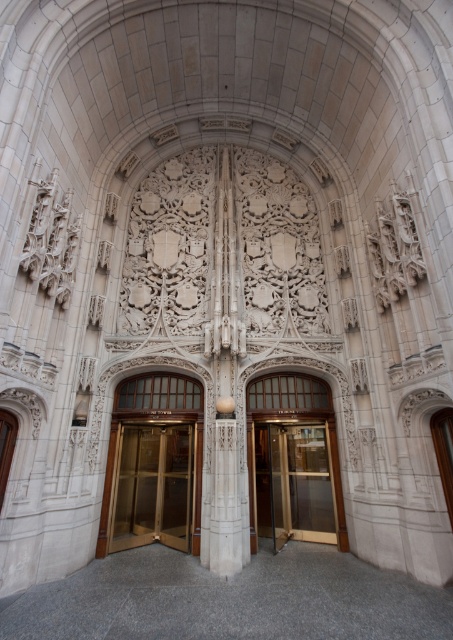
Can you confirm if gold/glass elevator at center is smaller than gold/glass elevator doors at center?

Yes.

Who is positioned more to the right, gold/glass elevator at center or gold/glass elevator doors at center?

gold/glass elevator at center

Image resolution: width=453 pixels, height=640 pixels. What are the coordinates of `gold/glass elevator at center` in the screenshot? It's located at (297, 483).

Does point (144, 483) come behind point (225, 428)?

That is True.

Is point (163, 442) positioned before point (230, 483)?

No, (163, 442) is behind (230, 483).

Identify the location of gold/glass elevator doors at center. This screenshot has height=640, width=453. (152, 486).

Can you confirm if gold/glass elevator at center is positioned to the left of white marble pillar at center?

No, gold/glass elevator at center is not to the left of white marble pillar at center.

Between gold/glass elevator at center and white marble pillar at center, which one appears on the left side from the viewer's perspective?

white marble pillar at center is more to the left.

Identify the location of gold/glass elevator at center. The height and width of the screenshot is (640, 453). (297, 483).